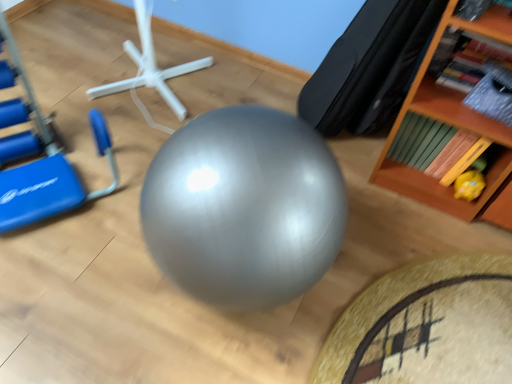
Question: Is black leather bean bag chair at upper right a part of yellow rubber duck at lower right?

Choices:
 (A) no
 (B) yes

Answer: (A)

Question: Is yellow rubber duck at lower right positioned far away from black leather bean bag chair at upper right?

Choices:
 (A) no
 (B) yes

Answer: (A)

Question: Considering the relative sizes of yellow rubber duck at lower right and black leather bean bag chair at upper right in the image provided, is yellow rubber duck at lower right bigger than black leather bean bag chair at upper right?

Choices:
 (A) yes
 (B) no

Answer: (B)

Question: Can you confirm if yellow rubber duck at lower right is positioned to the left of black leather bean bag chair at upper right?

Choices:
 (A) yes
 (B) no

Answer: (B)

Question: Is yellow rubber duck at lower right oriented towards black leather bean bag chair at upper right?

Choices:
 (A) yes
 (B) no

Answer: (B)

Question: Is wooden bookshelf at upper right inside or outside of blue plastic swivel chair at left?

Choices:
 (A) outside
 (B) inside

Answer: (A)

Question: In the image, is wooden bookshelf at upper right positioned in front of or behind blue plastic swivel chair at left?

Choices:
 (A) behind
 (B) front

Answer: (A)

Question: Is wooden bookshelf at upper right bigger or smaller than blue plastic swivel chair at left?

Choices:
 (A) big
 (B) small

Answer: (B)

Question: From their relative heights in the image, would you say wooden bookshelf at upper right is taller or shorter than blue plastic swivel chair at left?

Choices:
 (A) short
 (B) tall

Answer: (B)

Question: Based on their positions, is white plastic stand at center located to the left or right of wooden bookshelf at upper right?

Choices:
 (A) right
 (B) left

Answer: (B)

Question: Considering the positions of white plastic stand at center and wooden bookshelf at upper right in the image, is white plastic stand at center taller or shorter than wooden bookshelf at upper right?

Choices:
 (A) short
 (B) tall

Answer: (A)

Question: Is white plastic stand at center situated inside wooden bookshelf at upper right or outside?

Choices:
 (A) outside
 (B) inside

Answer: (A)

Question: Looking at the image, does white plastic stand at center seem bigger or smaller compared to wooden bookshelf at upper right?

Choices:
 (A) big
 (B) small

Answer: (A)

Question: Based on their sizes in the image, would you say yellow rubber duck at lower right is bigger or smaller than black leather bean bag chair at upper right?

Choices:
 (A) small
 (B) big

Answer: (A)

Question: Considering the positions of point (484, 153) and point (314, 87), is point (484, 153) closer or farther from the camera than point (314, 87)?

Choices:
 (A) closer
 (B) farther

Answer: (A)